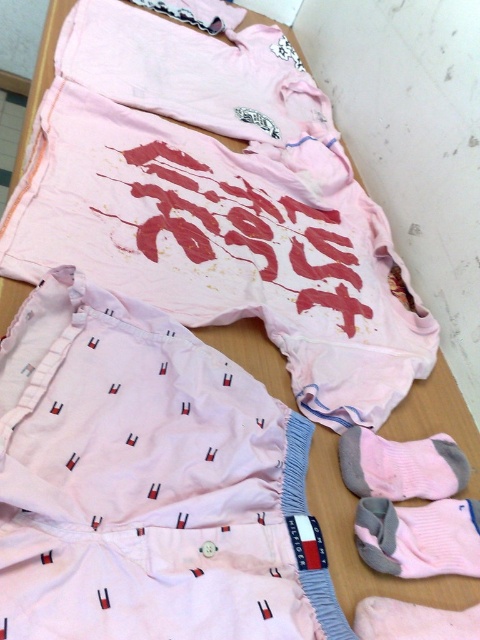
You are a delivery robot with a 20 inch arm reach. You need to pick up the pink cotton shorts at lower left and the gray cotton sock at lower right. Can your arm reach both items at the same time?

The pink cotton shorts at lower left and gray cotton sock at lower right are 22.36 inches apart from each other. Since your arm can only reach 20 inches, you cannot reach both items at the same time.

Consider the image. You are standing at the origin point in the image. Which object is located at the coordinates point (217, 204)?

The pink cotton shorts at lower left is located at the coordinates point (217, 204).

You are organizing a drawer and need to place the pink cotton shorts at lower left and the gray cotton sock at lower right. If the drawer has a width of 30 cm, can both items fit side by side without overlapping?

The pink cotton shorts at lower left might be wider than the gray cotton sock at lower right, so their combined width may exceed 30 cm. Check their exact dimensions to ensure they fit.